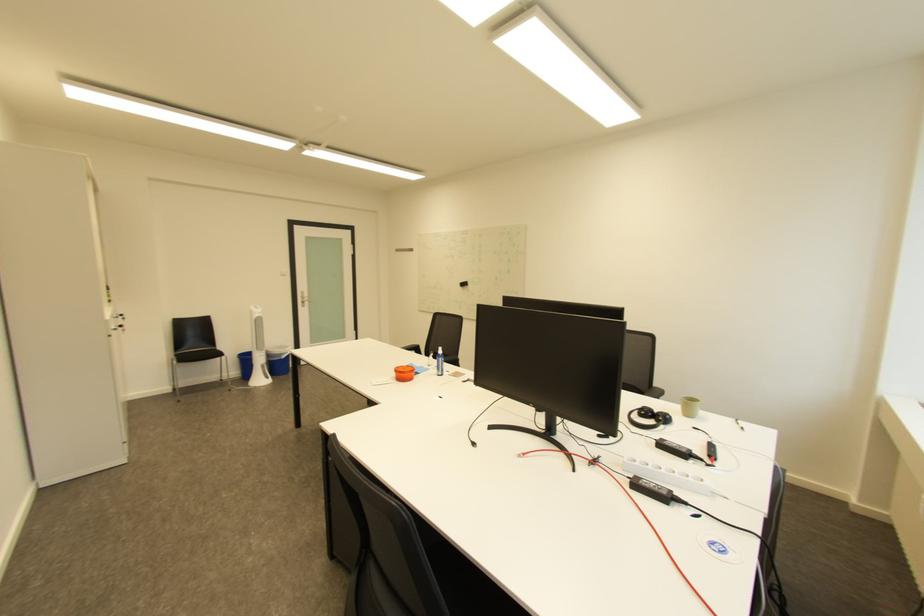
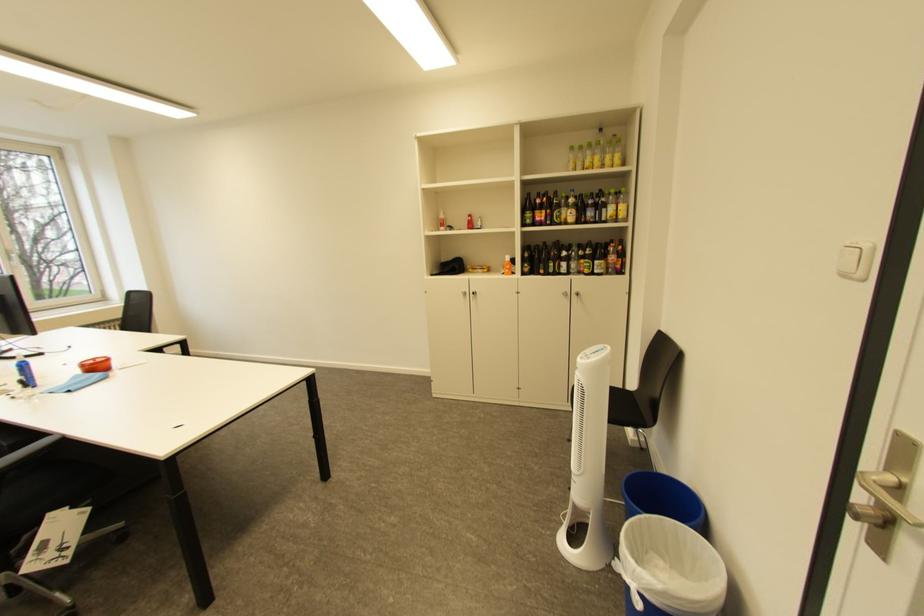
Find the pixel in the second image that matches pixel 297 353 in the first image.

(636, 570)